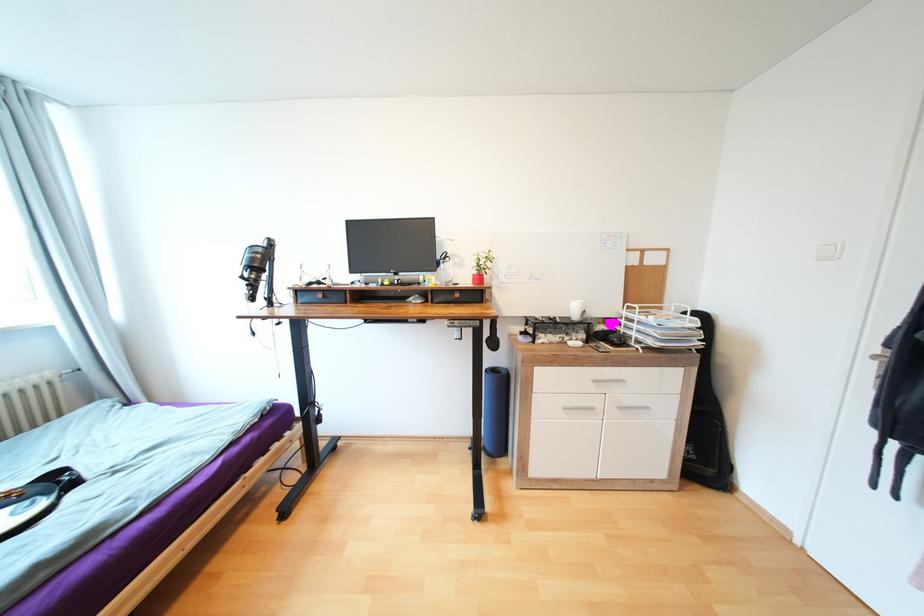
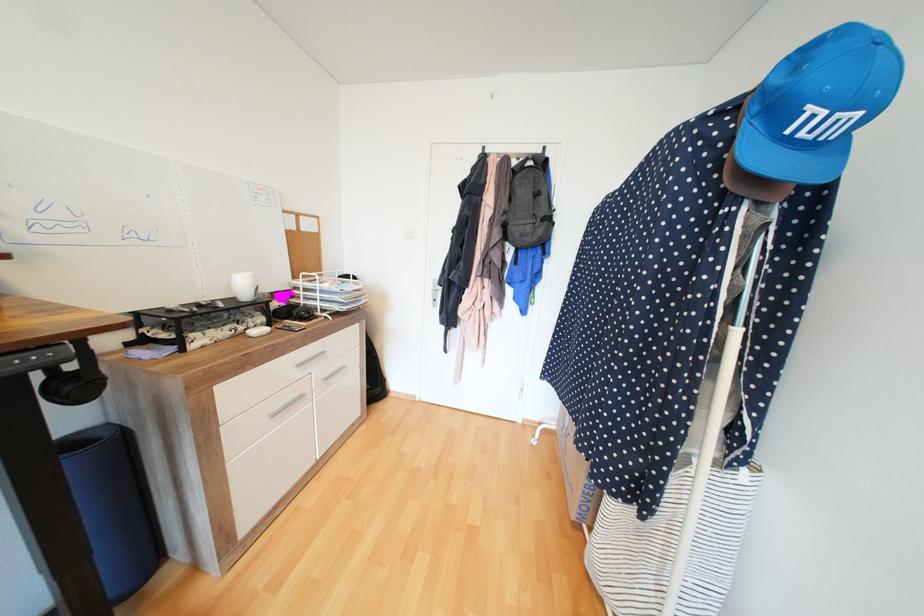
The point at [500,344] is marked in the first image. Where is the corresponding point in the second image?

(88, 387)